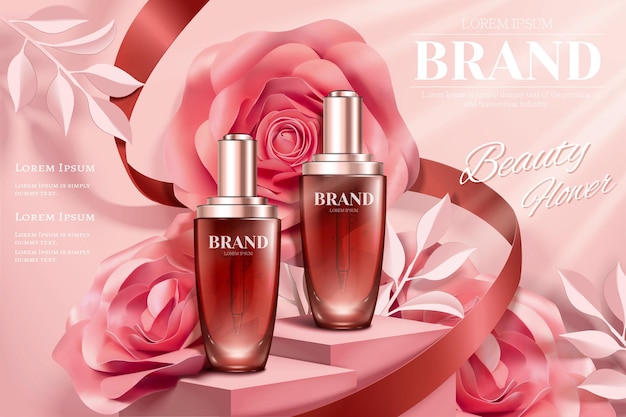
This screenshot has width=626, height=417. Find the location of `bottle`. bottle is located at coordinates (371, 273).